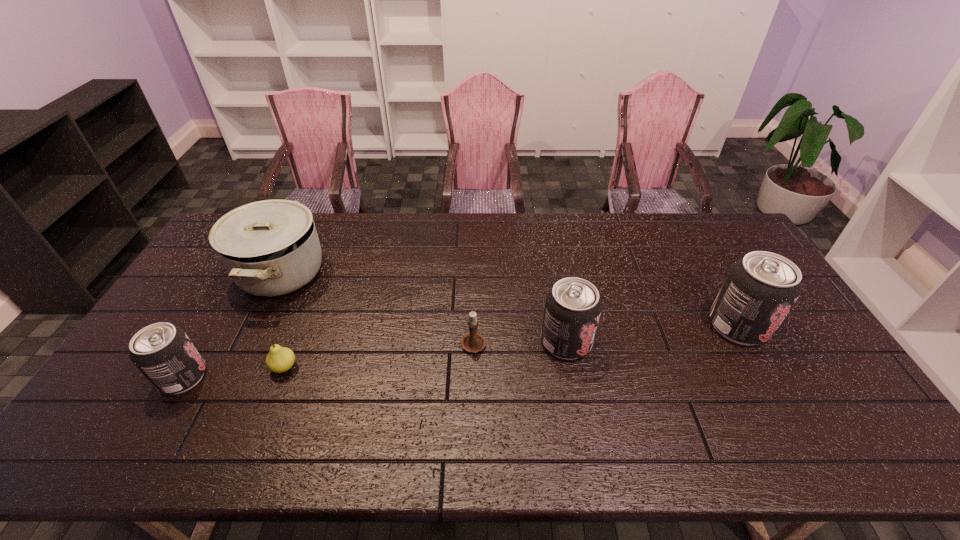
Where is `vacant area situated 0.060m on the left of the second object from right to left`? This screenshot has height=540, width=960. vacant area situated 0.060m on the left of the second object from right to left is located at coordinates (519, 342).

You are a GUI agent. You are given a task and a screenshot of the screen. Output one action in this format:
    pyautogui.click(x=<x>, y=<y>)
    Task: Click on the vacant space situated 0.270m on the back of the rightmost object
    The image size is (960, 540).
    Given the screenshot: What is the action you would take?
    pyautogui.click(x=695, y=249)

Locate an element on the screen. vacant region located on the right of the saucepan is located at coordinates (430, 272).

The height and width of the screenshot is (540, 960). Find the location of `free space located on the back of the shortest object`. free space located on the back of the shortest object is located at coordinates (314, 293).

The width and height of the screenshot is (960, 540). I want to click on free space located 0.230m on the side of the fifth tallest object with the handle, so click(x=474, y=276).

Locate an element on the screen. blank area located on the side of the fifth tallest object with the handle is located at coordinates (474, 293).

The height and width of the screenshot is (540, 960). I want to click on vacant space located 0.220m on the side of the fifth tallest object with the handle, so click(x=474, y=278).

Find the location of a particular element. The image size is (960, 540). object located at the far edge is located at coordinates (270, 248).

In order to click on object that is at the near edge in this screenshot , I will do `click(163, 353)`.

Identify the location of soda can at the left edge. Image resolution: width=960 pixels, height=540 pixels. (163, 353).